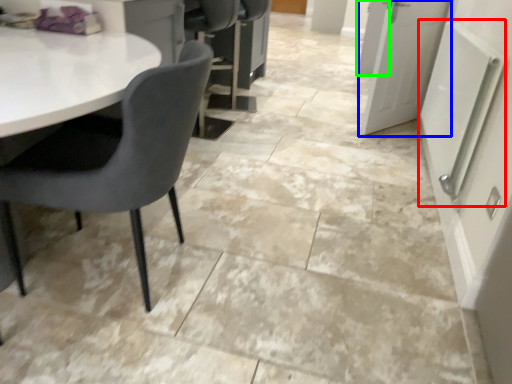
Question: Which object is the farthest from radiator (highlighted by a red box)? Choose among these: door (highlighted by a blue box) or door (highlighted by a green box).

Choices:
 (A) door
 (B) door

Answer: (B)